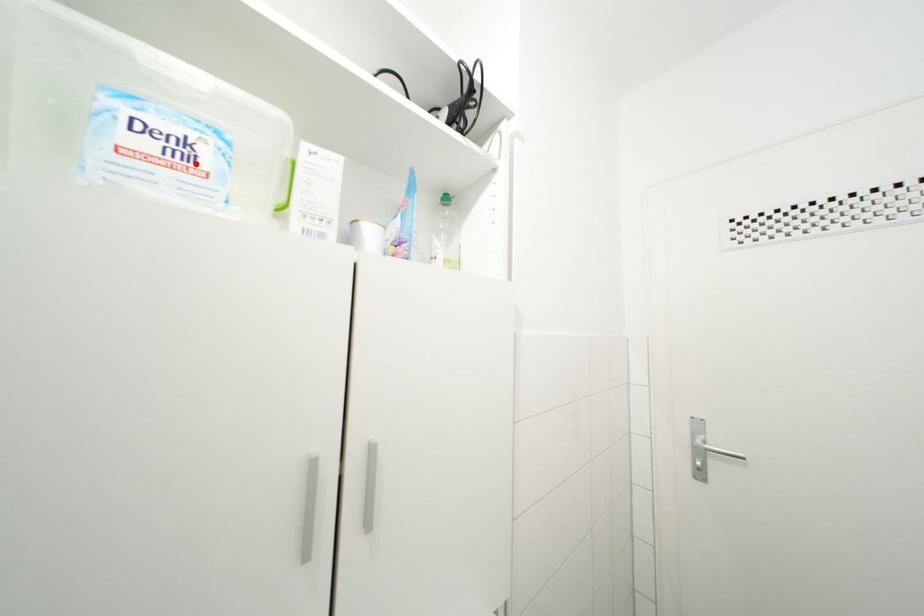
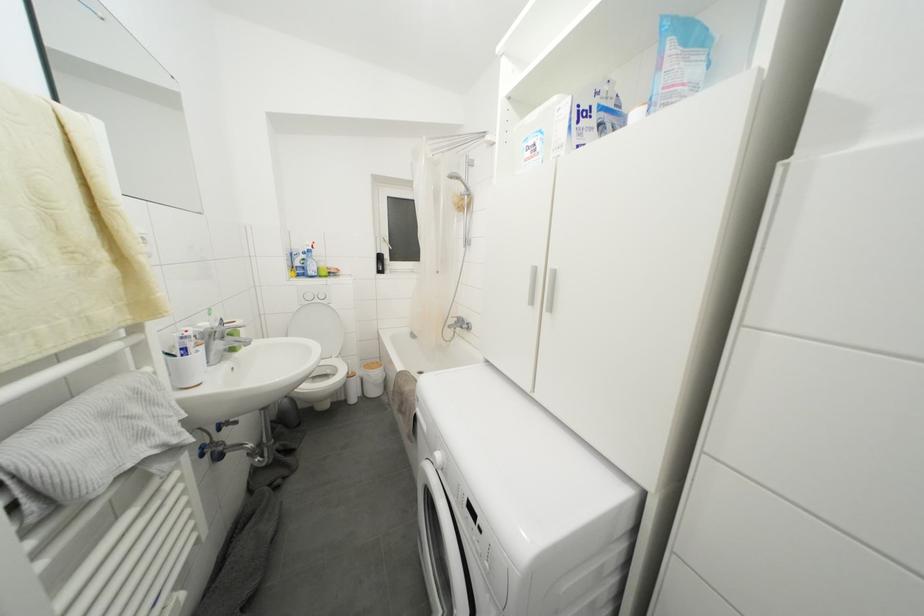
Where in the second image is the point corresponding to the highlighted location from the first image?

(540, 155)